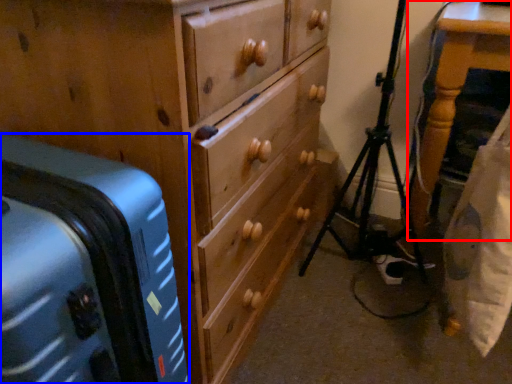
Question: Which of the following is the farthest to the observer, furniture (highlighted by a red box) or suitcase (highlighted by a blue box)?

Choices:
 (A) furniture
 (B) suitcase

Answer: (A)